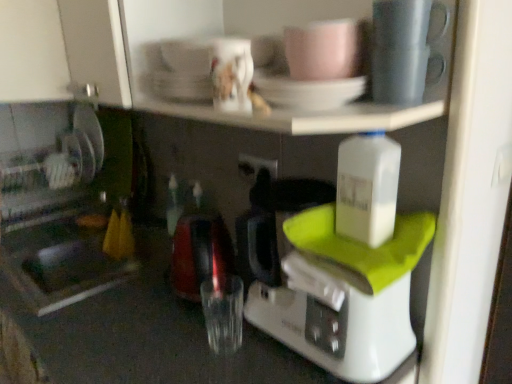
Question: From the image's perspective, is black plastic electric outlet at center beneath white plastic bottle at center-right?

Choices:
 (A) yes
 (B) no

Answer: (B)

Question: Is black plastic electric outlet at center placed right next to white plastic bottle at center-right?

Choices:
 (A) yes
 (B) no

Answer: (B)

Question: From the image's perspective, is black plastic electric outlet at center over white plastic bottle at center-right?

Choices:
 (A) no
 (B) yes

Answer: (B)

Question: From a real-world perspective, is black plastic electric outlet at center on white plastic bottle at center-right?

Choices:
 (A) no
 (B) yes

Answer: (A)

Question: Does black plastic electric outlet at center appear on the left side of white plastic bottle at center-right?

Choices:
 (A) no
 (B) yes

Answer: (B)

Question: Would you say matte gray mug at upper right, the second tableware positioned from the left, is inside or outside porcelain white coffee cup at upper center, the first coffee cup in the left-to-right sequence?

Choices:
 (A) outside
 (B) inside

Answer: (A)

Question: Is matte gray mug at upper right, which is the 1th tableware in right-to-left order, bigger or smaller than porcelain white coffee cup at upper center, the first coffee cup in the left-to-right sequence?

Choices:
 (A) big
 (B) small

Answer: (A)

Question: From a real-world perspective, is matte gray mug at upper right, which is the 1th tableware in right-to-left order, positioned above or below porcelain white coffee cup at upper center, the 2th coffee cup positioned from the right?

Choices:
 (A) below
 (B) above

Answer: (A)

Question: In the image, is matte gray mug at upper right, which is the 1th tableware in right-to-left order, positioned in front of or behind porcelain white coffee cup at upper center, the first coffee cup in the left-to-right sequence?

Choices:
 (A) behind
 (B) front

Answer: (B)

Question: From the image's perspective, is black plastic electric outlet at center positioned above or below pink matte mug at upper center, positioned as the second coffee cup in left-to-right order?

Choices:
 (A) above
 (B) below

Answer: (B)

Question: Is black plastic electric outlet at center wider or thinner than pink matte mug at upper center, placed as the first coffee cup when sorted from right to left?

Choices:
 (A) wide
 (B) thin

Answer: (B)

Question: From a real-world perspective, is black plastic electric outlet at center physically located above or below pink matte mug at upper center, positioned as the second coffee cup in left-to-right order?

Choices:
 (A) below
 (B) above

Answer: (A)

Question: In terms of height, does black plastic electric outlet at center look taller or shorter compared to pink matte mug at upper center, positioned as the second coffee cup in left-to-right order?

Choices:
 (A) tall
 (B) short

Answer: (B)

Question: Does point (275, 177) appear closer or farther from the camera than point (373, 379)?

Choices:
 (A) farther
 (B) closer

Answer: (A)

Question: From a real-world perspective, relative to white plastic coffee maker at center, is black plastic electric outlet at center vertically above or below?

Choices:
 (A) above
 (B) below

Answer: (A)